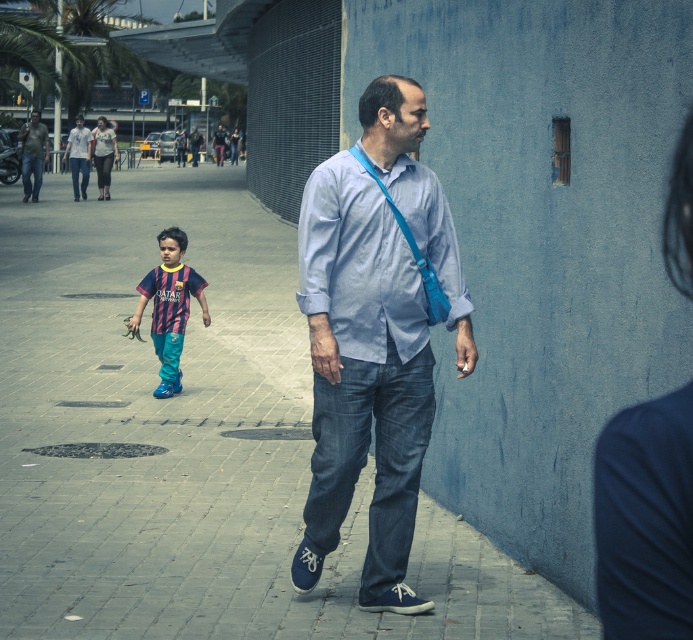
Is brick pavement at center above light blue cotton shirt at center?

Correct, brick pavement at center is located above light blue cotton shirt at center.

Who is lower down, brick pavement at center or light blue cotton shirt at center?

light blue cotton shirt at center is below.

Is point (188, 621) farther from viewer compared to point (326, 284)?

Yes.

This screenshot has height=640, width=693. I want to click on brick pavement at center, so click(193, 442).

Can you confirm if blue denim jeans at center is bigger than matte blue shirt at center?

No.

Is blue denim jeans at center positioned behind matte blue shirt at center?

No, blue denim jeans at center is closer to the viewer.

Is point (385, 164) positioned before point (76, 144)?

Yes, it is in front of point (76, 144).

Image resolution: width=693 pixels, height=640 pixels. In order to click on blue denim jeans at center in this screenshot , I will do `click(376, 333)`.

Can you confirm if brick pavement at center is bigger than matte blue shirt at center?

Correct, brick pavement at center is larger in size than matte blue shirt at center.

In the scene shown: Is brick pavement at center smaller than matte blue shirt at center?

No.

Which is behind, point (12, 632) or point (89, 140)?

Positioned behind is point (89, 140).

Locate an element on the screen. brick pavement at center is located at coordinates coord(193,442).